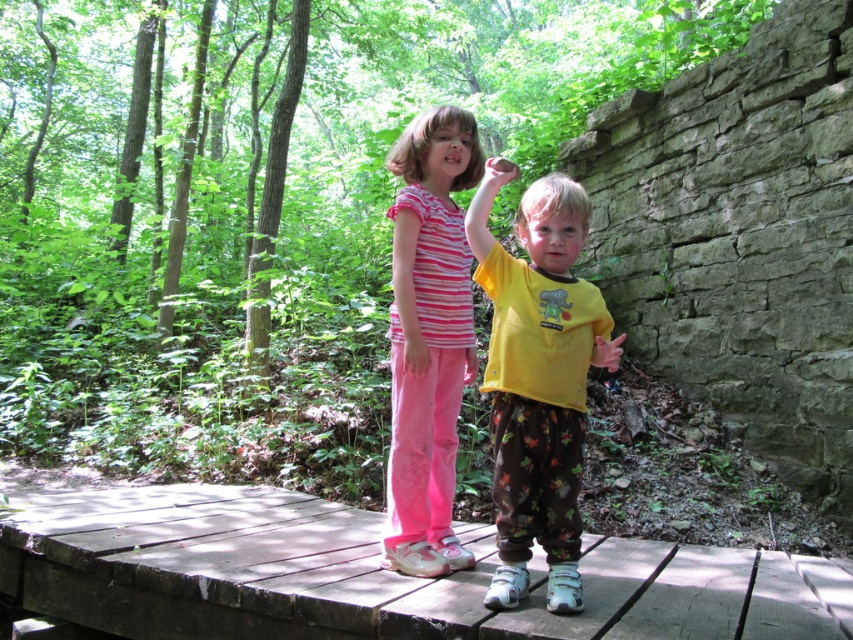
Looking at this image, is wooden planks at center in front of striped cotton shirt at center?

Yes.

Which of these two, wooden planks at center or striped cotton shirt at center, stands shorter?

With less height is wooden planks at center.

This screenshot has height=640, width=853. What do you see at coordinates (372, 576) in the screenshot?
I see `wooden planks at center` at bounding box center [372, 576].

Locate an element on the screen. The width and height of the screenshot is (853, 640). wooden planks at center is located at coordinates (372, 576).

Can you confirm if yellow matte shirt at center is wider than striped cotton shirt at center?

Yes, yellow matte shirt at center is wider than striped cotton shirt at center.

The height and width of the screenshot is (640, 853). Describe the element at coordinates (538, 378) in the screenshot. I see `yellow matte shirt at center` at that location.

Between point (544, 365) and point (451, 493), which one is positioned in front?

Positioned in front is point (544, 365).

In order to click on yellow matte shirt at center in this screenshot , I will do `click(538, 378)`.

Is wooden planks at center shorter than yellow matte shirt at center?

Yes, wooden planks at center is shorter than yellow matte shirt at center.

This screenshot has width=853, height=640. What are the coordinates of `wooden planks at center` in the screenshot? It's located at (372, 576).